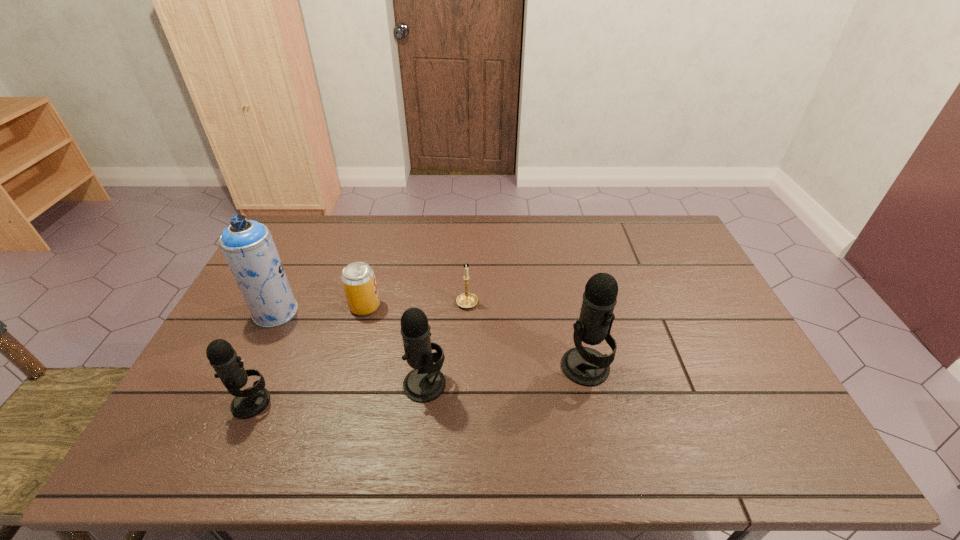
You are a GUI agent. You are given a task and a screenshot of the screen. Output one action in this format:
    pyautogui.click(x=<x>, y=<y>)
    Task: Click on the vacant space located 0.400m on the right of the rightmost microphone
    
    Given the screenshot: What is the action you would take?
    pyautogui.click(x=759, y=367)

Where is `vacant space located on the back of the pop (soda)`? vacant space located on the back of the pop (soda) is located at coordinates (371, 285).

This screenshot has height=540, width=960. I want to click on vacant region located on the front of the aerosol can, so click(x=225, y=417).

Locate an element on the screen. Image resolution: width=960 pixels, height=540 pixels. vacant space situated 0.210m on the handle side of the fifth object from left to right is located at coordinates (468, 251).

You are a GUI agent. You are given a task and a screenshot of the screen. Output one action in this format:
    pyautogui.click(x=<x>, y=<y>)
    Task: Click on the free point located 0.100m on the handle side of the fifth object from left to right
    
    Given the screenshot: What is the action you would take?
    pyautogui.click(x=468, y=272)

The height and width of the screenshot is (540, 960). In order to click on vacant region located 0.050m on the handle side of the fifth object from left to right in this screenshot , I will do `click(468, 281)`.

Where is `microphone located in the left edge section of the desktop`? microphone located in the left edge section of the desktop is located at coordinates (249, 402).

You are a GUI agent. You are given a task and a screenshot of the screen. Output one action in this format:
    pyautogui.click(x=<x>, y=<y>)
    Task: Click on the aerosol can that is at the left edge
    This screenshot has width=960, height=540.
    Given the screenshot: What is the action you would take?
    pyautogui.click(x=248, y=246)

This screenshot has width=960, height=540. What are the coordinates of `object that is at the near left corner` in the screenshot? It's located at (249, 402).

Identify the location of vacant position at the far edge of the desktop. click(427, 229).